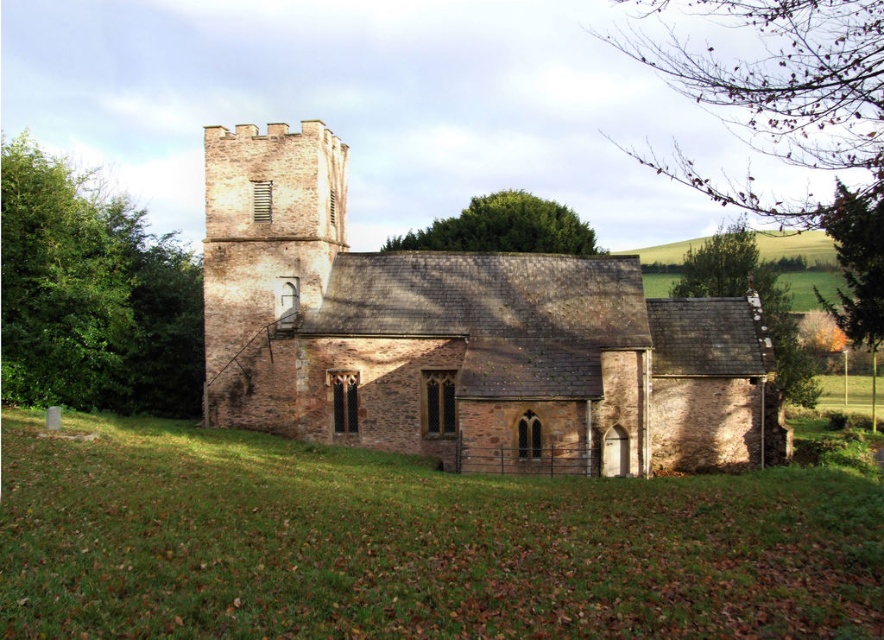
Which is in front, point (1, 221) or point (478, 211)?

Point (1, 221)

The image size is (884, 640). Describe the element at coordinates (92, 296) in the screenshot. I see `green leafy tree at left` at that location.

Identify the location of green leafy tree at left. (92, 296).

Locate an element on the screen. The height and width of the screenshot is (640, 884). green leafy tree at left is located at coordinates point(92,296).

Is point (288, 189) closer to viewer compared to point (587, 225)?

Yes, it is.

Identify the location of brown stone tower at center-left. The image size is (884, 640). (265, 262).

Where is `brown stone tower at center-left`? brown stone tower at center-left is located at coordinates (265, 262).

Who is taller, green leafy tree at left or green grassy hillside at upper right?

With more height is green leafy tree at left.

What do you see at coordinates (92, 296) in the screenshot? I see `green leafy tree at left` at bounding box center [92, 296].

Which is in front, point (75, 333) or point (824, 250)?

Point (75, 333) is in front.

Find the location of `green leafy tree at left`. green leafy tree at left is located at coordinates (92, 296).